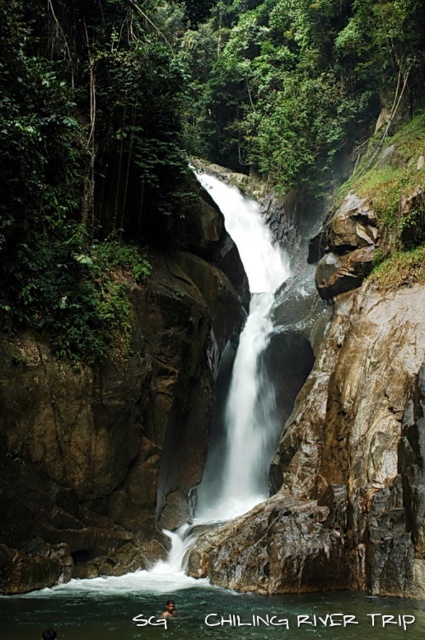
You are a photographer positioned at the lower left corner of the scene. You want to capture a closeup of the brown textured hair at center. Which direction should you move to get closer to it?

The brown textured hair at center is located at point [169,609], so you should move towards the right and slightly upwards to get closer to it.

You are standing at the base of the waterfall and want to determine which of the two points, point [223,625] or point [44,637], is closer to you. Which point is nearer?

Point [44,637] is closer to you because it is less further to the camera than point [223,625].

You are a photographer standing in front of the waterfall scene. You want to capture both the white smooth waterfall at center and the brown textured hair at center in your shot. Which object will appear bigger in your photo?

The white smooth waterfall at center will appear bigger in your photo since it has a larger size compared to the brown textured hair at center.